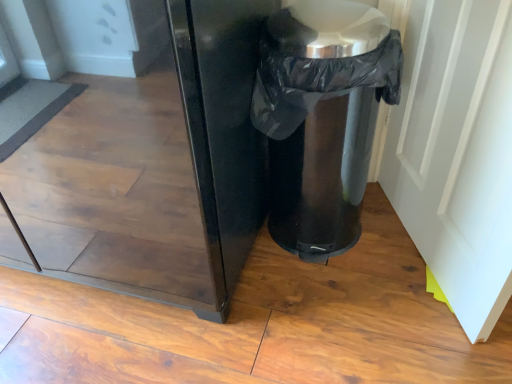
Question: In terms of height, does white glossy door at right look taller or shorter compared to black plastic trash can at lower right?

Choices:
 (A) tall
 (B) short

Answer: (A)

Question: From a real-world perspective, is white glossy door at right positioned above or below black plastic trash can at lower right?

Choices:
 (A) below
 (B) above

Answer: (B)

Question: Considering the positions of point (479, 223) and point (283, 69), is point (479, 223) closer or farther from the camera than point (283, 69)?

Choices:
 (A) farther
 (B) closer

Answer: (A)

Question: Relative to white glossy door at right, is black plastic trash can at lower right in front or behind?

Choices:
 (A) behind
 (B) front

Answer: (A)

Question: Considering the positions of point (359, 11) and point (443, 34), is point (359, 11) closer or farther from the camera than point (443, 34)?

Choices:
 (A) closer
 (B) farther

Answer: (A)

Question: Considering the positions of black plastic trash can at lower right and white glossy door at right in the image, is black plastic trash can at lower right bigger or smaller than white glossy door at right?

Choices:
 (A) big
 (B) small

Answer: (A)

Question: Considering the positions of black plastic trash can at lower right and white glossy door at right in the image, is black plastic trash can at lower right taller or shorter than white glossy door at right?

Choices:
 (A) tall
 (B) short

Answer: (B)